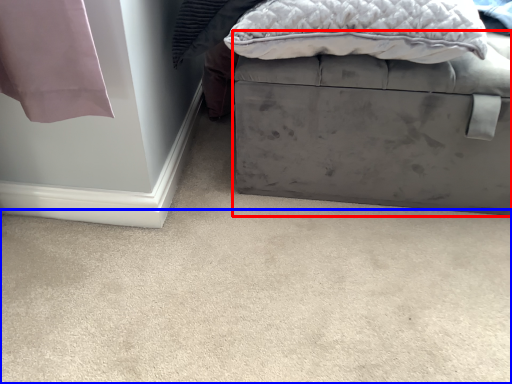
Question: Which of the following is the closest to the observer, furniture (highlighted by a red box) or concrete (highlighted by a blue box)?

Choices:
 (A) furniture
 (B) concrete

Answer: (B)